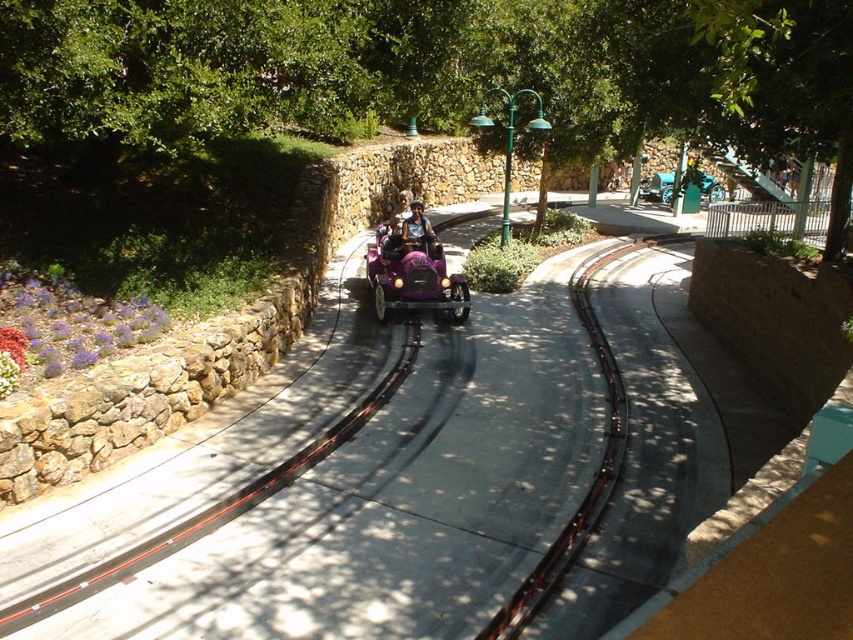
You are standing in the theme park and want to take a photo of the matte purple toy car at center from a distance where it will appear as large as possible in your camera frame. Considering your camera can focus clearly up to 30 feet away, should you move closer or farther away from your current position to ensure the car is in focus and as large as possible?

The matte purple toy car at center is currently 36.45 feet away, which is beyond the camera focus limit of 30 feet. To ensure the car is in focus and appears as large as possible, you should move closer to reduce the distance below 30 feet while maintaining the desired framing.

You are a visitor at the theme park and want to take a photo of both the matte purple toy car at center and the metallic teal car at center. Since you can only focus on one car at a time, which car should you focus on first to ensure the other is still in the frame?

The matte purple toy car at center is located below the metallic teal car at center, so you should focus on the metallic teal car at center first. This way, the lower positioned matte purple toy car at center will remain in the frame as you adjust your focus.